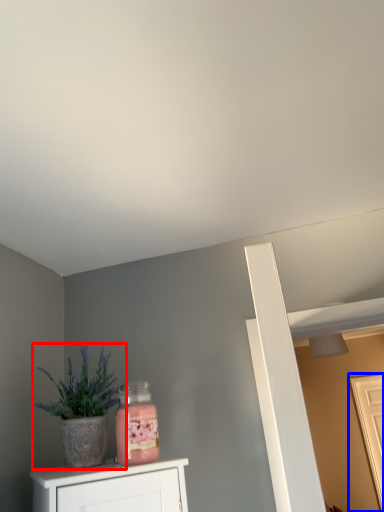
Question: Which of the following is the closest to the observer, houseplant (highlighted by a red box) or door (highlighted by a blue box)?

Choices:
 (A) houseplant
 (B) door

Answer: (A)